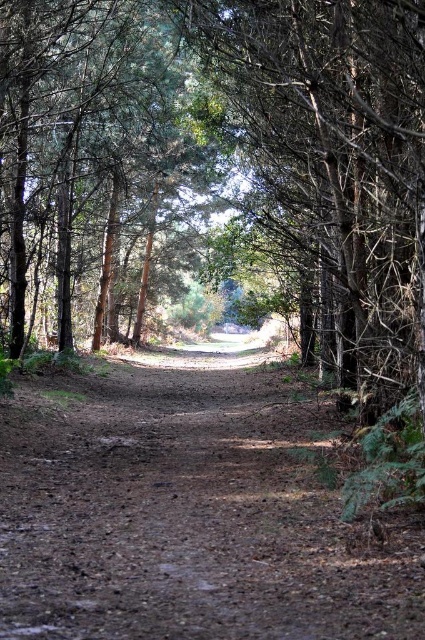
Question: Can you confirm if brown dirt track at center is wider than green matte tree at center?

Choices:
 (A) yes
 (B) no

Answer: (B)

Question: Does brown dirt track at center lie behind green matte tree at center?

Choices:
 (A) no
 (B) yes

Answer: (A)

Question: Which point is farther to the camera?

Choices:
 (A) green matte tree at center
 (B) brown dirt track at center

Answer: (A)

Question: Is brown dirt track at center positioned behind green matte tree at center?

Choices:
 (A) no
 (B) yes

Answer: (A)